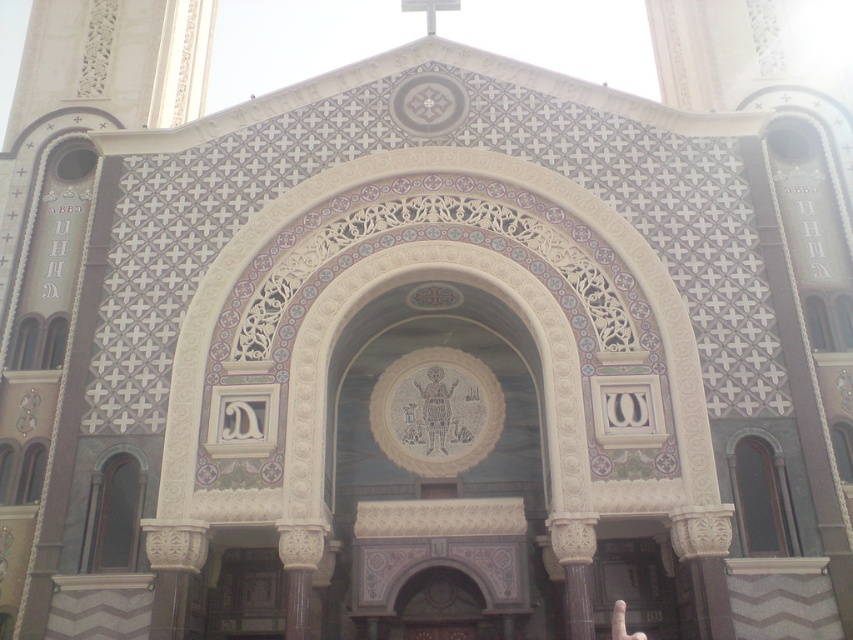
You are standing in front of the grand architectural structure and want to locate the white glossy cross at upper center. According to the coordinates provided, where exactly would you look on the facade?

The white glossy cross at upper center is located at point coordinates of (428, 10) on the facade.

You are standing in front of the grand church facade. You see the transparent glass door at left and the white glossy cross at upper center. Which object is positioned higher on the facade?

The white glossy cross at upper center is positioned higher on the facade than the transparent glass door at left.